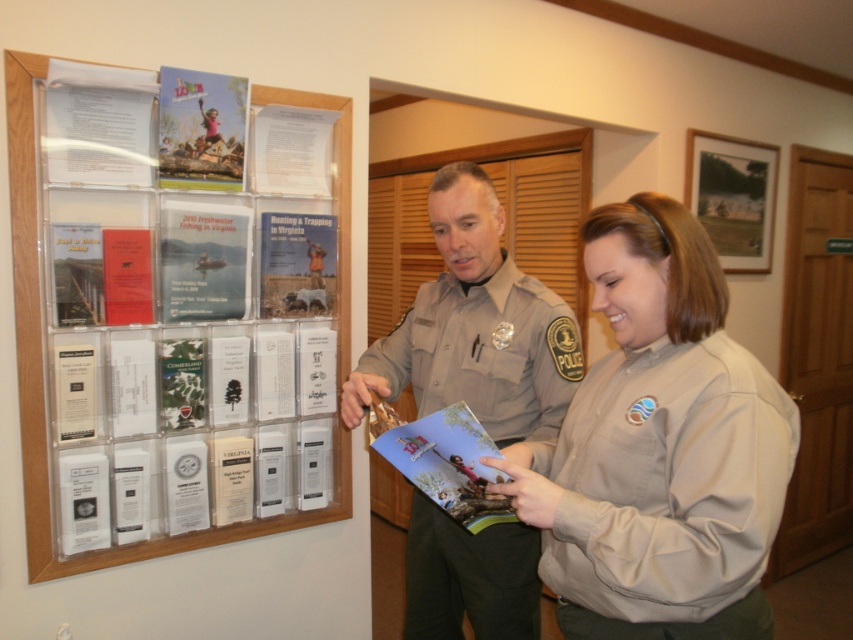
Does beige uniform at center appear over tan uniform at center?

Yes, beige uniform at center is above tan uniform at center.

Is beige uniform at center smaller than tan uniform at center?

Indeed, beige uniform at center has a smaller size compared to tan uniform at center.

Is point (544, 456) positioned after point (405, 564)?

No.

Identify the location of beige uniform at center. This screenshot has width=853, height=640. (659, 449).

Is point (113, 371) more distant than point (419, 353)?

No, (113, 371) is in front of (419, 353).

Describe the element at coordinates (187, 324) in the screenshot. I see `matte plastic brochure at upper left` at that location.

You are a GUI agent. You are given a task and a screenshot of the screen. Output one action in this format:
    pyautogui.click(x=<x>, y=<y>)
    Task: Click on the matte plastic brochure at upper left
    The width and height of the screenshot is (853, 640).
    Given the screenshot: What is the action you would take?
    pyautogui.click(x=187, y=324)

Looking at this image, is beige uniform at center thinner than matte paper poster at center?

No.

Consider the image. Who is higher up, beige uniform at center or matte paper poster at center?

Positioned higher is matte paper poster at center.

Find the location of `beige uniform at center`. beige uniform at center is located at coordinates (659, 449).

Identify the location of beige uniform at center. (659, 449).